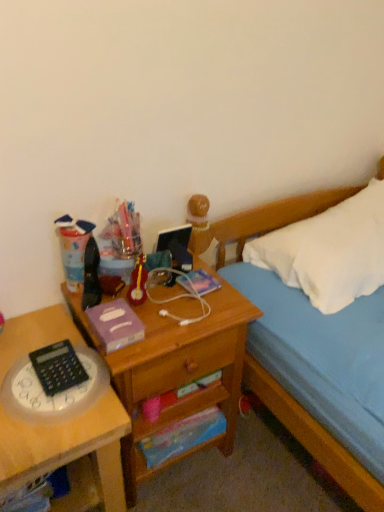
Where is `free spot behind translucent plastic clock at lower left`? free spot behind translucent plastic clock at lower left is located at coordinates (39, 327).